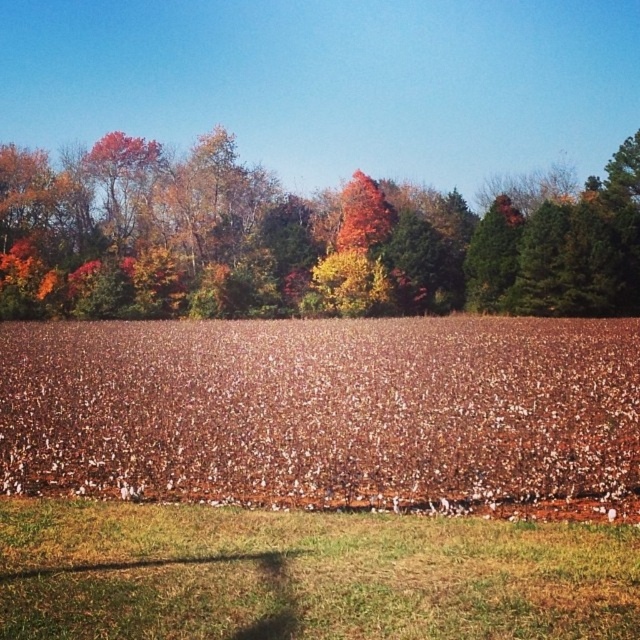
Does autumn leaves at upper center have a greater width compared to brown grass at lower center?

Yes, autumn leaves at upper center is wider than brown grass at lower center.

Can you confirm if autumn leaves at upper center is positioned below brown grass at lower center?

No.

What do you see at coordinates (300, 237) in the screenshot?
I see `autumn leaves at upper center` at bounding box center [300, 237].

Locate an element on the screen. autumn leaves at upper center is located at coordinates (300, 237).